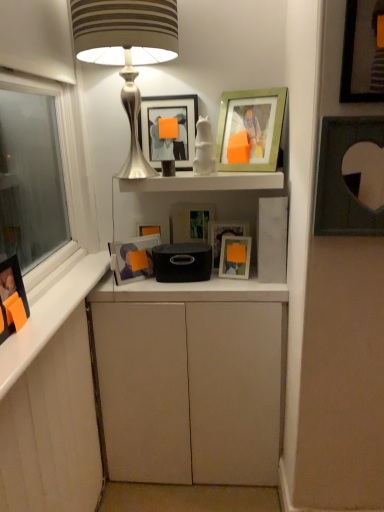
The image size is (384, 512). In order to click on vacant region above matte white cabinet at center (from a real-world perspective) in this screenshot , I will do `click(190, 281)`.